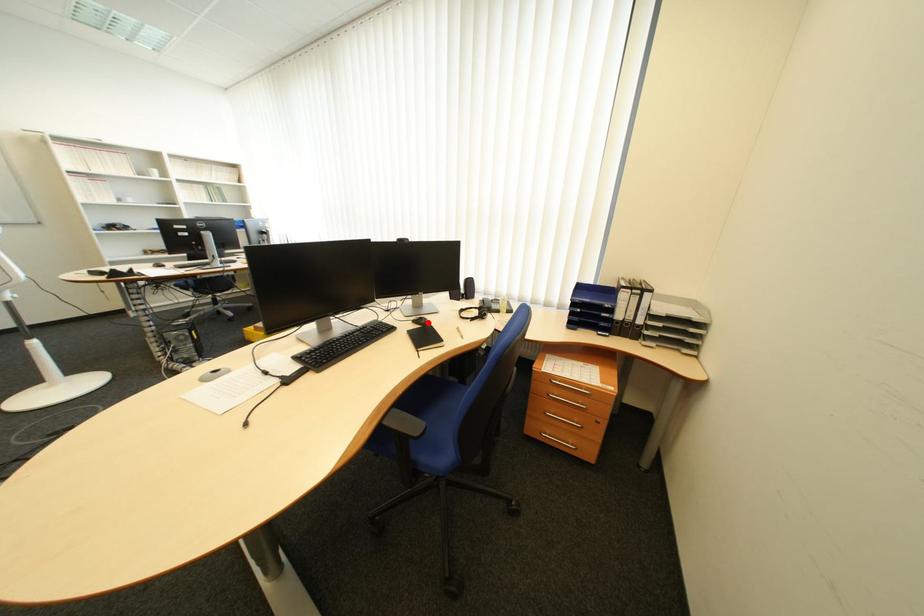
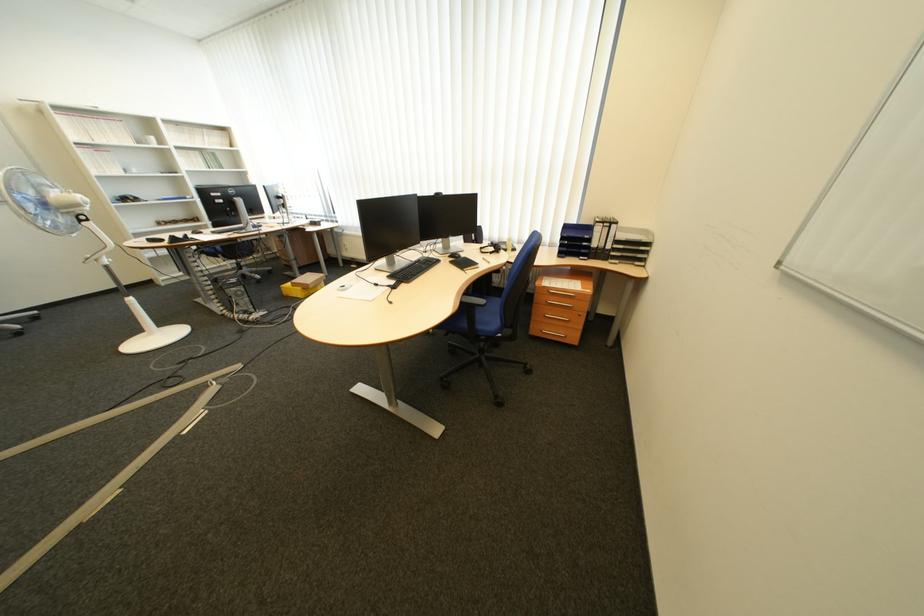
Locate, in the second image, the point that corresponds to the highlighted location in the first image.

(464, 257)